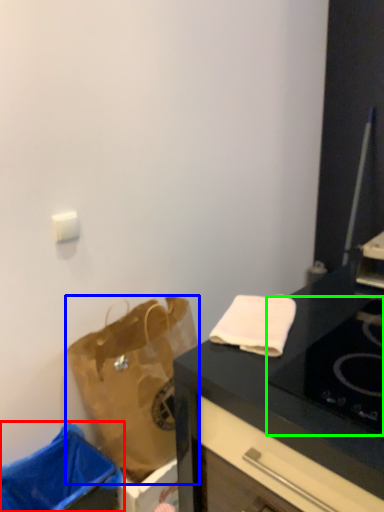
Question: Estimate the real-world distances between objects in this image. Which object is farther from trash bin/can (highlighted by a red box), handbag (highlighted by a blue box) or gas stove (highlighted by a green box)?

Choices:
 (A) handbag
 (B) gas stove

Answer: (B)